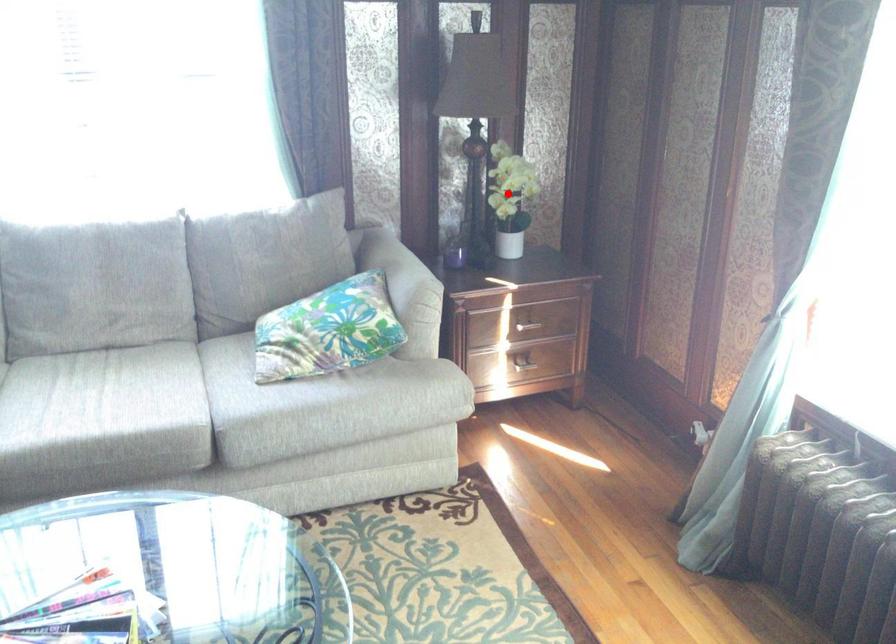
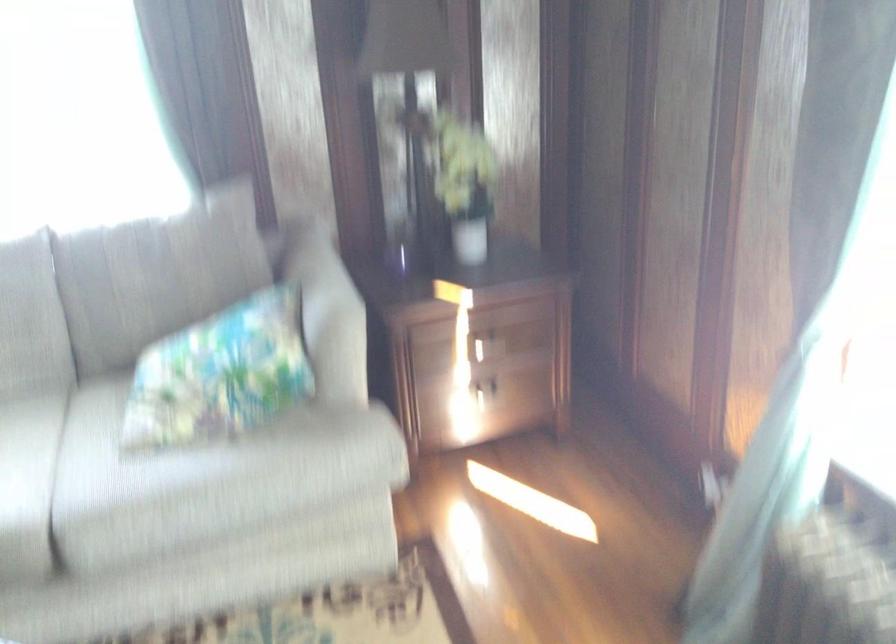
Question: I am providing you with two images of the same scene from different viewpoints. In image1, a red point is highlighted. Considering the same 3D point in image2, which of the following is correct?

Choices:
 (A) It is closer
 (B) It is farther

Answer: (A)